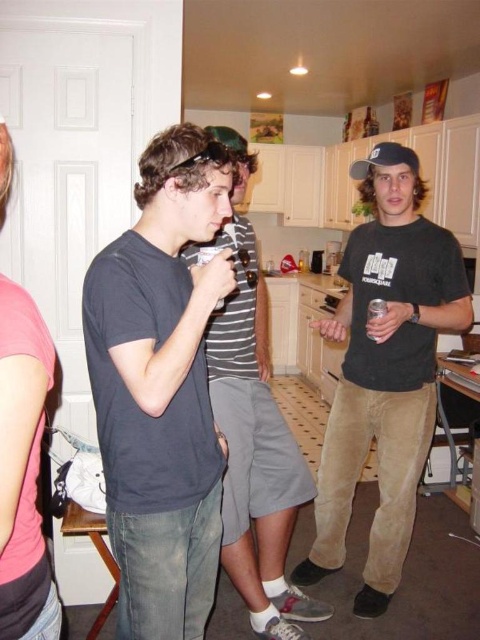
Looking at this image, between dark gray t-shirt at center and black suede t-shirt at center, which one has more height?

black suede t-shirt at center

Is point (192, 609) farther from camera compared to point (351, 236)?

That is False.

Identify the location of dark gray t-shirt at center. This screenshot has width=480, height=640. (160, 387).

Measure the distance between black suede t-shirt at center and camera.

black suede t-shirt at center is 6.35 feet from camera.

Between black suede t-shirt at center and clear plastic cup at center right, which one has more height?

black suede t-shirt at center

Find the location of a particular element. black suede t-shirt at center is located at coordinates (384, 371).

Can you confirm if matte black t-shirt at center is positioned to the left of clear plastic cup at center right?

Indeed, matte black t-shirt at center is positioned on the left side of clear plastic cup at center right.

Is matte black t-shirt at center positioned behind clear plastic cup at center right?

No.

I want to click on matte black t-shirt at center, so click(x=253, y=429).

Locate an element on the screen. The width and height of the screenshot is (480, 640). matte black t-shirt at center is located at coordinates (253, 429).